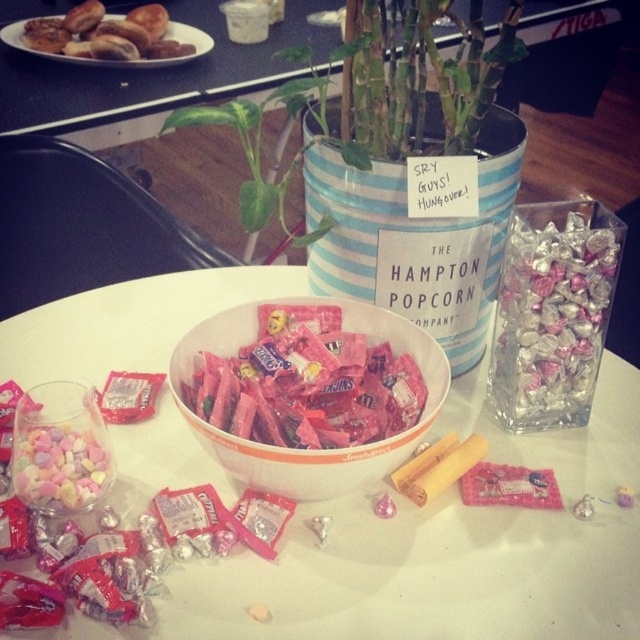
Between white glossy table at center and pastel matte heart-shaped candies at lower left, which one is positioned higher?

white glossy table at center

Who is more distant from viewer, (410, 611) or (19, 490)?

Point (19, 490)

Locate an element on the screen. The image size is (640, 640). white glossy table at center is located at coordinates (440, 550).

Which of these two, silver foil wrapped chocolates at right or pastel matte heart-shaped candies at lower left, stands shorter?

With less height is pastel matte heart-shaped candies at lower left.

Is point (557, 316) positioned after point (36, 500)?

That is True.

Is point (522, 208) closer to viewer compared to point (32, 472)?

No, (522, 208) is behind (32, 472).

Identify the location of silver foil wrapped chocolates at right. (552, 314).

Is point (339, 449) farther from camera compared to point (161, 60)?

No, (339, 449) is in front of (161, 60).

Can you confirm if pink matte candy bowl at center is taller than golden brown pastries at upper left?

In fact, pink matte candy bowl at center may be shorter than golden brown pastries at upper left.

Locate an element on the screen. This screenshot has height=640, width=640. pink matte candy bowl at center is located at coordinates click(x=308, y=449).